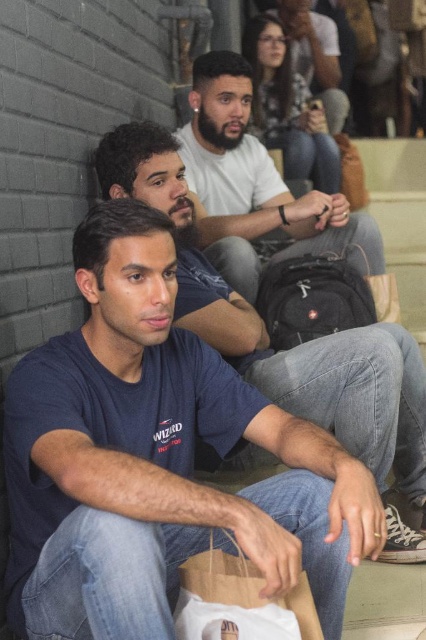
Question: Which is farther from the bearded man at center?

Choices:
 (A) white cotton t-shirt at center
 (B) blue cotton t-shirt at center

Answer: (B)

Question: Can you confirm if brown paper bag at lower center is positioned above bearded man at center?

Choices:
 (A) no
 (B) yes

Answer: (A)

Question: Which object appears farthest from the camera in this image?

Choices:
 (A) bearded man at center
 (B) white cotton t-shirt at center
 (C) brown paper bag at lower center

Answer: (A)

Question: Does brown paper bag at lower center appear under bearded man at center?

Choices:
 (A) no
 (B) yes

Answer: (B)

Question: Considering the real-world distances, which object is farthest from the brown paper bag at lower center?

Choices:
 (A) bearded man at center
 (B) blue cotton t-shirt at center
 (C) white cotton t-shirt at center

Answer: (A)

Question: Can you confirm if white cotton t-shirt at center is wider than brown paper bag at lower center?

Choices:
 (A) no
 (B) yes

Answer: (B)